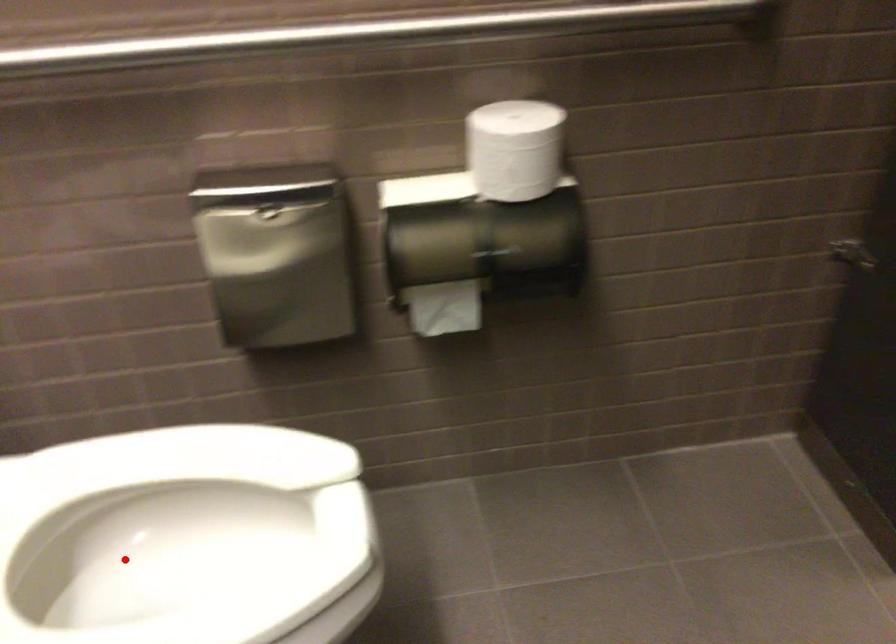
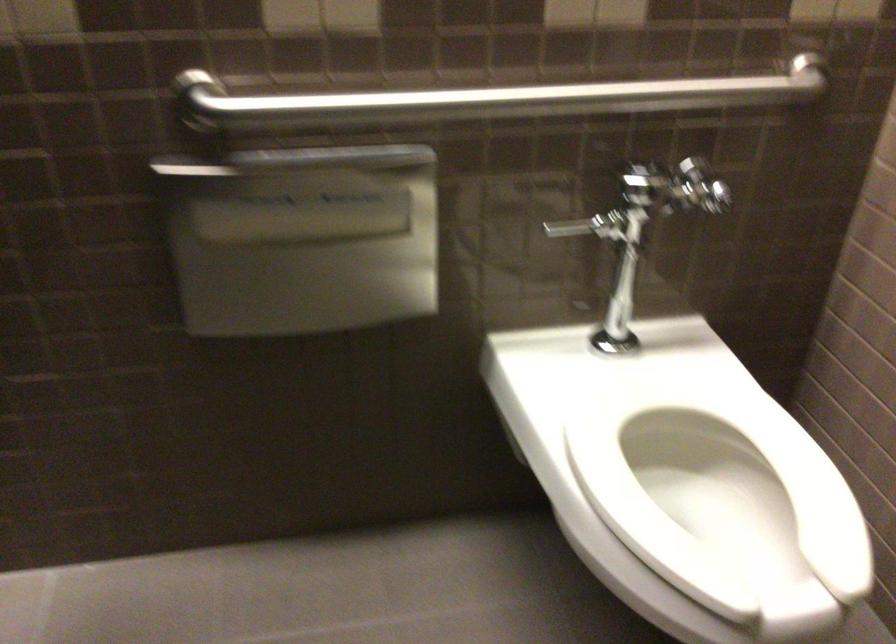
Find the pixel in the second image that matches the highlighted location in the first image.

(719, 494)